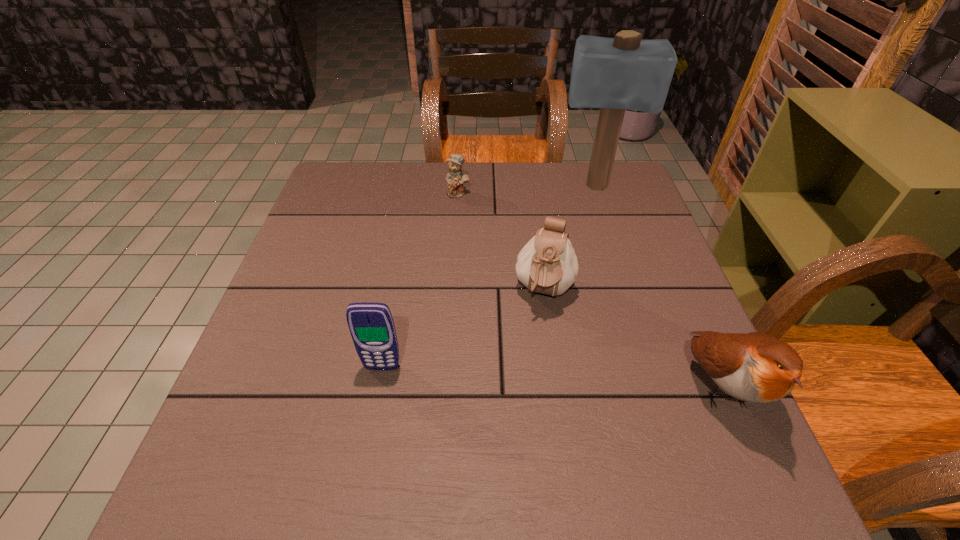
You are a GUI agent. You are given a task and a screenshot of the screen. Output one action in this format:
    pyautogui.click(x=<x>, y=<y>)
    Task: Click on the bird situated at the right edge
    The image size is (960, 540).
    Given the screenshot: What is the action you would take?
    pyautogui.click(x=754, y=367)

You are a GUI agent. You are given a task and a screenshot of the screen. Output one action in this format:
    pyautogui.click(x=<x>, y=<y>)
    Task: Click on the mallet present at the right edge
    
    Given the screenshot: What is the action you would take?
    pyautogui.click(x=614, y=74)

Image resolution: width=960 pixels, height=540 pixels. I want to click on object present at the far right corner, so click(x=614, y=74).

Image resolution: width=960 pixels, height=540 pixels. Identify the location of object that is at the near right corner. (754, 367).

Image resolution: width=960 pixels, height=540 pixels. Identify the location of vacant region at the far edge. (x=571, y=187).

This screenshot has height=540, width=960. Identify the location of free space at the near edge of the desktop. (343, 435).

Where is `vacant space at the left edge of the desktop`? This screenshot has height=540, width=960. vacant space at the left edge of the desktop is located at coordinates point(370,212).

This screenshot has height=540, width=960. In the image, there is a desktop. In order to click on blank space at the right edge in this screenshot , I will do `click(606, 267)`.

In the image, there is a desktop. Where is `vacant space at the far left corner`? The width and height of the screenshot is (960, 540). vacant space at the far left corner is located at coordinates (330, 200).

Locate an element on the screen. Image resolution: width=960 pixels, height=540 pixels. vacant space in between the teddy bear and the pouch is located at coordinates (501, 242).